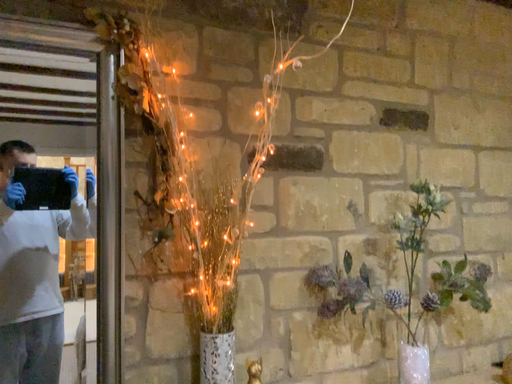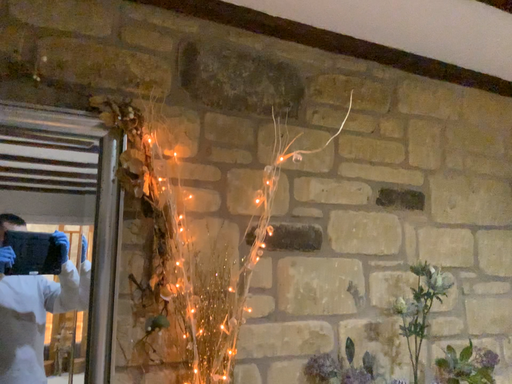
Question: How did the camera likely rotate when shooting the video?

Choices:
 (A) rotated downward
 (B) rotated upward

Answer: (B)